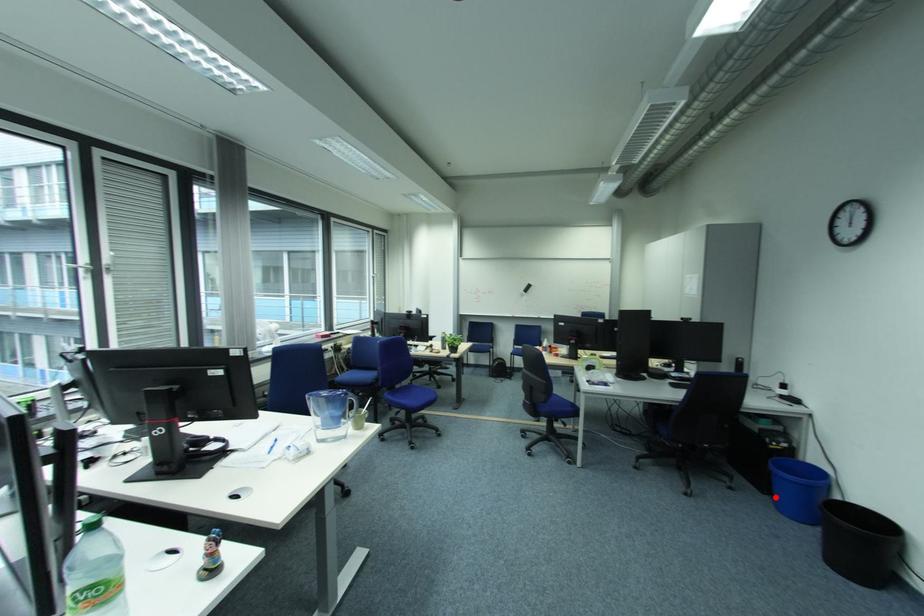
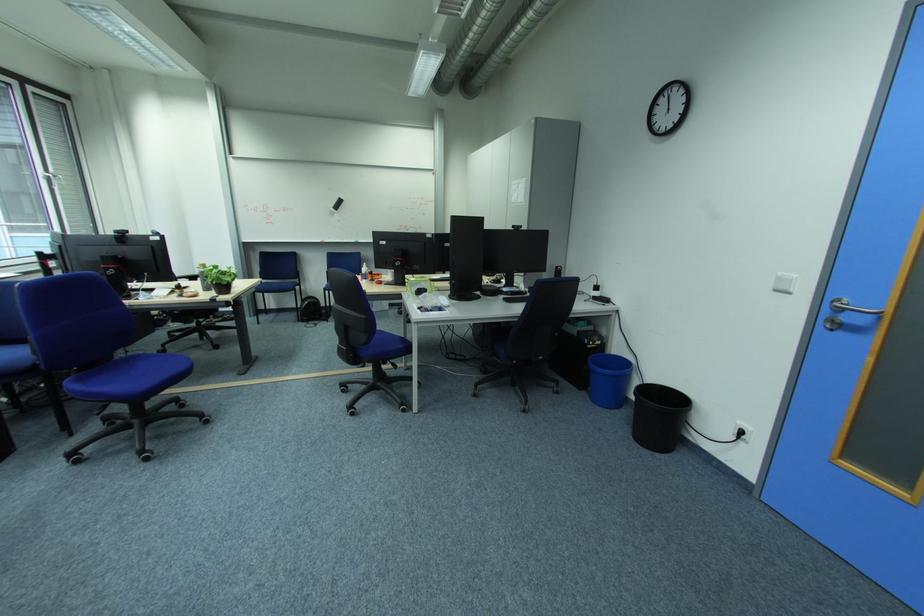
Question: I am providing you with two images of the same scene from different viewpoints. A red point is shown in image1. For the corresponding object point in image2, is it positioned nearer or farther from the camera?

Choices:
 (A) Nearer
 (B) Farther

Answer: (A)